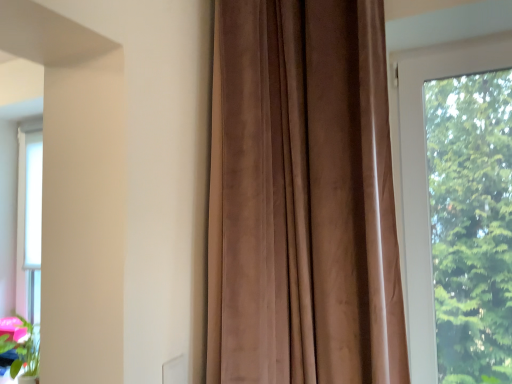
The image size is (512, 384). Describe the element at coordinates (425, 176) in the screenshot. I see `transparent glass window at right` at that location.

Locate an element on the screen. transparent glass window at right is located at coordinates (425, 176).

This screenshot has width=512, height=384. What do you see at coordinates (303, 197) in the screenshot?
I see `suede-like brown curtain at center` at bounding box center [303, 197].

Where is `suede-like brown curtain at center`? suede-like brown curtain at center is located at coordinates (303, 197).

This screenshot has height=384, width=512. What are the coordinates of `transparent glass window at right` in the screenshot? It's located at (425, 176).

Is suede-like brown curtain at center to the right of transparent glass window at right from the viewer's perspective?

No.

Is suede-like brown curtain at center further to camera compared to transparent glass window at right?

No, suede-like brown curtain at center is in front of transparent glass window at right.

Which is closer, (x=266, y=156) or (x=408, y=231)?

The point (x=266, y=156) is closer.

From the image's perspective, is suede-like brown curtain at center positioned above or below transparent glass window at right?

suede-like brown curtain at center is above transparent glass window at right.

From a real-world perspective, which object stands above the other?

suede-like brown curtain at center is physically above.

Considering the sizes of suede-like brown curtain at center and transparent glass window at right in the image, is suede-like brown curtain at center wider or thinner than transparent glass window at right?

Considering their sizes, suede-like brown curtain at center looks broader than transparent glass window at right.

Between suede-like brown curtain at center and transparent glass window at right, which one has less height?

transparent glass window at right.

Considering the sizes of suede-like brown curtain at center and transparent glass window at right in the image, is suede-like brown curtain at center bigger or smaller than transparent glass window at right?

In the image, suede-like brown curtain at center appears to be larger than transparent glass window at right.

Is suede-like brown curtain at center completely or partially outside of transparent glass window at right?

Yes.

Consider the image. Can you see suede-like brown curtain at center touching transparent glass window at right?

No, suede-like brown curtain at center is not making contact with transparent glass window at right.

Is suede-like brown curtain at center oriented towards transparent glass window at right?

No, suede-like brown curtain at center is not turned towards transparent glass window at right.

Can you tell me how much suede-like brown curtain at center and transparent glass window at right differ in facing direction?

0.469 degrees.

Measure the distance between suede-like brown curtain at center and transparent glass window at right.

A distance of 16.84 inches exists between suede-like brown curtain at center and transparent glass window at right.

This screenshot has width=512, height=384. Identify the location of window that is behind the suede-like brown curtain at center. (425, 176).

Considering the positions of objects transparent glass window at right and suede-like brown curtain at center in the image provided, who is more to the right, transparent glass window at right or suede-like brown curtain at center?

From the viewer's perspective, transparent glass window at right appears more on the right side.

Between transparent glass window at right and suede-like brown curtain at center, which one is positioned in front?

suede-like brown curtain at center is closer to the camera.

Which is nearer, (436,49) or (263,130)?

Point (263,130)

From the image's perspective, which is below, transparent glass window at right or suede-like brown curtain at center?

transparent glass window at right appears lower in the image.

From a real-world perspective, which is physically below, transparent glass window at right or suede-like brown curtain at center?

transparent glass window at right, from a real-world perspective.

Which of these two, transparent glass window at right or suede-like brown curtain at center, is wider?

Wider between the two is suede-like brown curtain at center.

Considering the sizes of objects transparent glass window at right and suede-like brown curtain at center in the image provided, who is taller, transparent glass window at right or suede-like brown curtain at center?

Standing taller between the two is suede-like brown curtain at center.

Is transparent glass window at right bigger than suede-like brown curtain at center?

No.

From the picture: Do you think transparent glass window at right is within suede-like brown curtain at center, or outside of it?

transparent glass window at right is not enclosed by suede-like brown curtain at center.

Is transparent glass window at right positioned far away from suede-like brown curtain at center?

No, there isn't a large distance between transparent glass window at right and suede-like brown curtain at center.

Is transparent glass window at right oriented towards suede-like brown curtain at center?

No.

How many degrees apart are the facing directions of transparent glass window at right and suede-like brown curtain at center?

0.469 degrees separate the facing orientations of transparent glass window at right and suede-like brown curtain at center.

The image size is (512, 384). I want to click on curtain above the transparent glass window at right (from a real-world perspective), so click(x=303, y=197).

Find the location of `curtain that appears above the transparent glass window at right (from the image's perspective)`. curtain that appears above the transparent glass window at right (from the image's perspective) is located at coordinates (303, 197).

This screenshot has height=384, width=512. In order to click on curtain that is in front of the transparent glass window at right in this screenshot , I will do `click(303, 197)`.